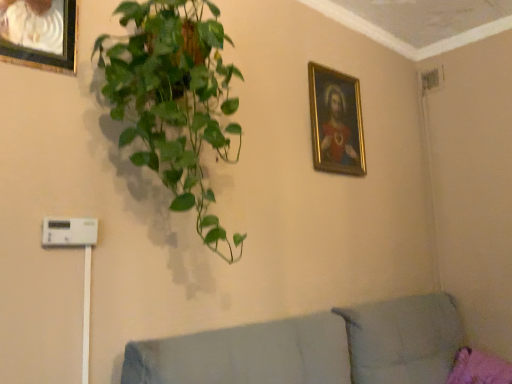
Question: Does gold-framed painting at upper right, acting as the second picture frame starting from the front, contain brushed metal picture frame at upper left, which appears as the first picture frame when viewed from the left?

Choices:
 (A) no
 (B) yes

Answer: (A)

Question: From the image's perspective, is gold-framed painting at upper right, which is the 2th picture frame from left to right, located above brushed metal picture frame at upper left, which ranks as the second picture frame in back-to-front order?

Choices:
 (A) no
 (B) yes

Answer: (A)

Question: Are gold-framed painting at upper right, which is the 2th picture frame from left to right, and brushed metal picture frame at upper left, positioned as the second picture frame in right-to-left order, beside each other?

Choices:
 (A) yes
 (B) no

Answer: (B)

Question: Considering the relative sizes of gold-framed painting at upper right, which is the 2th picture frame from left to right, and brushed metal picture frame at upper left, positioned as the second picture frame in right-to-left order, in the image provided, is gold-framed painting at upper right, which is the 2th picture frame from left to right, thinner than brushed metal picture frame at upper left, positioned as the second picture frame in right-to-left order,?

Choices:
 (A) yes
 (B) no

Answer: (A)

Question: Can you confirm if gold-framed painting at upper right, the first picture frame in the right-to-left sequence, is positioned to the left of brushed metal picture frame at upper left, positioned as the second picture frame in right-to-left order?

Choices:
 (A) no
 (B) yes

Answer: (A)

Question: From a real-world perspective, is gold-framed painting at upper right, which is the 2th picture frame from left to right, over brushed metal picture frame at upper left, positioned as the second picture frame in right-to-left order?

Choices:
 (A) no
 (B) yes

Answer: (A)

Question: From the image's perspective, is light gray fabric couch at lower right beneath green glossy plant at upper left?

Choices:
 (A) no
 (B) yes

Answer: (B)

Question: From a real-world perspective, is light gray fabric couch at lower right located beneath green glossy plant at upper left?

Choices:
 (A) yes
 (B) no

Answer: (A)

Question: Is light gray fabric couch at lower right located outside green glossy plant at upper left?

Choices:
 (A) no
 (B) yes

Answer: (B)

Question: Is there a large distance between light gray fabric couch at lower right and green glossy plant at upper left?

Choices:
 (A) no
 (B) yes

Answer: (A)

Question: From a real-world perspective, is light gray fabric couch at lower right physically above green glossy plant at upper left?

Choices:
 (A) no
 (B) yes

Answer: (A)

Question: Is green glossy plant at upper left at the back of light gray fabric couch at lower right?

Choices:
 (A) no
 (B) yes

Answer: (A)

Question: Does green glossy plant at upper left lie in front of gold-framed painting at upper right, which is the 2th picture frame from left to right?

Choices:
 (A) no
 (B) yes

Answer: (B)